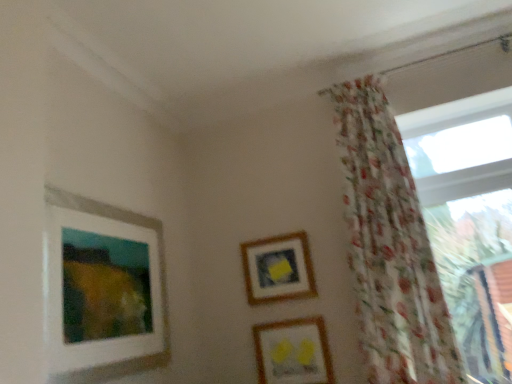
Question: Is white matte picture frame at upper left, the first picture frame when ordered from left to right, at the right side of wooden frame at center, marked as the 2th picture frame in a left-to-right arrangement?

Choices:
 (A) yes
 (B) no

Answer: (B)

Question: From the image's perspective, is white matte picture frame at upper left, which is the 3th picture frame from right to left, below wooden frame at center, positioned as the second picture frame in right-to-left order?

Choices:
 (A) yes
 (B) no

Answer: (B)

Question: Is wooden frame at center, marked as the 2th picture frame in a left-to-right arrangement, located within white matte picture frame at upper left, which is the 3th picture frame from right to left?

Choices:
 (A) yes
 (B) no

Answer: (B)

Question: Are white matte picture frame at upper left, the first picture frame when ordered from left to right, and wooden frame at center, positioned as the second picture frame in right-to-left order, making contact?

Choices:
 (A) yes
 (B) no

Answer: (B)

Question: Does white matte picture frame at upper left, the first picture frame when ordered from left to right, have a greater width compared to wooden frame at center, marked as the 2th picture frame in a left-to-right arrangement?

Choices:
 (A) yes
 (B) no

Answer: (A)

Question: Relative to wooden frame at center, marked as the 2th picture frame in a left-to-right arrangement, is transparent glass window at right in front or behind?

Choices:
 (A) front
 (B) behind

Answer: (A)

Question: Considering the positions of transparent glass window at right and wooden frame at center, marked as the 2th picture frame in a left-to-right arrangement, in the image, is transparent glass window at right taller or shorter than wooden frame at center, marked as the 2th picture frame in a left-to-right arrangement,?

Choices:
 (A) short
 (B) tall

Answer: (B)

Question: Considering the relative positions of transparent glass window at right and wooden frame at center, positioned as the second picture frame in right-to-left order, in the image provided, is transparent glass window at right to the left or to the right of wooden frame at center, positioned as the second picture frame in right-to-left order,?

Choices:
 (A) right
 (B) left

Answer: (A)

Question: In terms of width, does transparent glass window at right look wider or thinner when compared to wooden frame at center, marked as the 2th picture frame in a left-to-right arrangement?

Choices:
 (A) wide
 (B) thin

Answer: (A)

Question: Considering the positions of white matte picture frame at upper left, which is the 3th picture frame from right to left, and wooden frame at center, marked as the 2th picture frame in a left-to-right arrangement, in the image, is white matte picture frame at upper left, which is the 3th picture frame from right to left, taller or shorter than wooden frame at center, marked as the 2th picture frame in a left-to-right arrangement,?

Choices:
 (A) tall
 (B) short

Answer: (A)

Question: Is white matte picture frame at upper left, the first picture frame when ordered from left to right, wider or thinner than wooden frame at center, marked as the 2th picture frame in a left-to-right arrangement?

Choices:
 (A) thin
 (B) wide

Answer: (B)

Question: Would you say white matte picture frame at upper left, the first picture frame when ordered from left to right, is to the left or to the right of wooden frame at center, marked as the 2th picture frame in a left-to-right arrangement, in the picture?

Choices:
 (A) right
 (B) left

Answer: (B)

Question: Considering their positions, is white matte picture frame at upper left, the first picture frame when ordered from left to right, located in front of or behind wooden frame at center, positioned as the second picture frame in right-to-left order?

Choices:
 (A) behind
 (B) front

Answer: (B)

Question: Considering the positions of transparent glass window at right and floral sheer curtain at right in the image, is transparent glass window at right taller or shorter than floral sheer curtain at right?

Choices:
 (A) short
 (B) tall

Answer: (A)

Question: In terms of width, does transparent glass window at right look wider or thinner when compared to floral sheer curtain at right?

Choices:
 (A) wide
 (B) thin

Answer: (B)